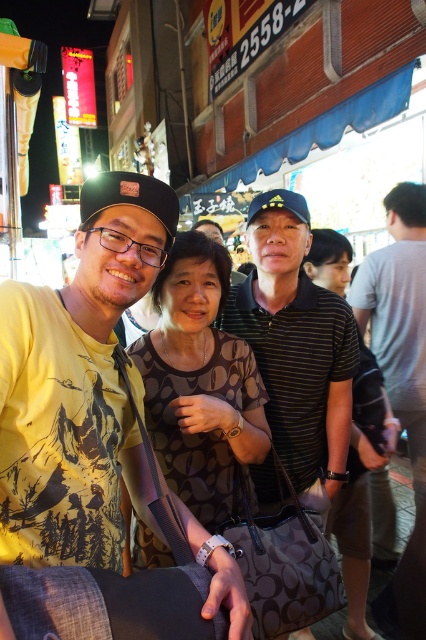
Is point (250, 240) less distant than point (158, 352)?

No, it is behind (158, 352).

Describe the element at coordinates (296, 346) in the screenshot. Image resolution: width=426 pixels, height=640 pixels. I see `striped cotton polo shirt at center` at that location.

The image size is (426, 640). What are the coordinates of `striped cotton polo shirt at center` in the screenshot? It's located at (296, 346).

Is dark brown textured blouse at center wider than black striped shirt at center?

Yes, dark brown textured blouse at center is wider than black striped shirt at center.

Between dark brown textured blouse at center and black striped shirt at center, which one has less height?

Standing shorter between the two is dark brown textured blouse at center.

At what (x,y) coordinates should I click in order to perform the action: click on dark brown textured blouse at center. Please return your answer as a coordinate pair (x, y). Image resolution: width=426 pixels, height=640 pixels. Looking at the image, I should click on tap(199, 381).

Between point (273, 486) and point (403, 248), which one is positioned in front?

Point (273, 486)

Where is `striped cotton polo shirt at center`? striped cotton polo shirt at center is located at coordinates (296, 346).